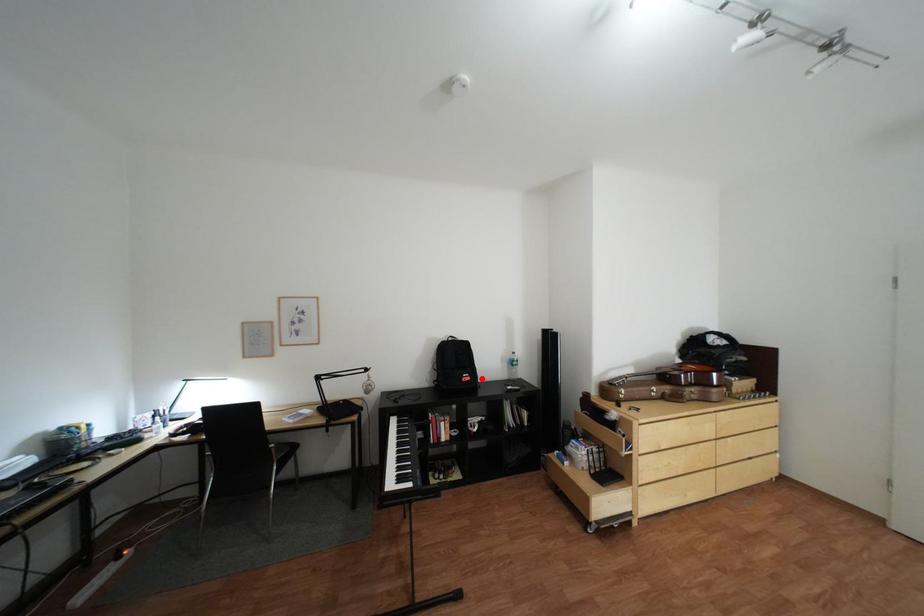
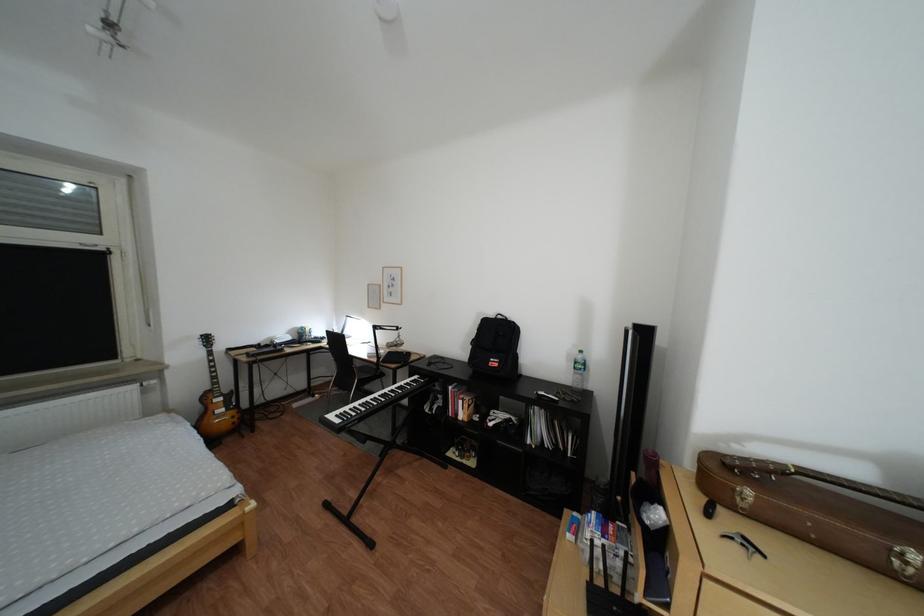
Find the pixel in the second image that matches the highlighted location in the first image.

(509, 363)